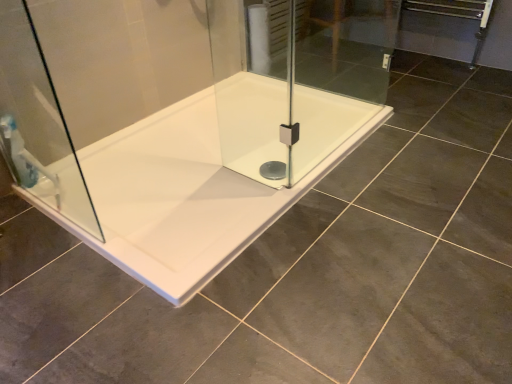
Question: From a real-world perspective, is translucent plastic shower at left on transparent glass shower door at left?

Choices:
 (A) yes
 (B) no

Answer: (B)

Question: Would you consider translucent plastic shower at left to be distant from transparent glass shower door at left?

Choices:
 (A) yes
 (B) no

Answer: (B)

Question: Is translucent plastic shower at left turned away from transparent glass shower door at left?

Choices:
 (A) no
 (B) yes

Answer: (B)

Question: From the image's perspective, does translucent plastic shower at left appear lower than transparent glass shower door at left?

Choices:
 (A) yes
 (B) no

Answer: (A)

Question: Considering the relative sizes of translucent plastic shower at left and transparent glass shower door at left in the image provided, is translucent plastic shower at left thinner than transparent glass shower door at left?

Choices:
 (A) yes
 (B) no

Answer: (B)

Question: Can you confirm if translucent plastic shower at left is positioned to the left of transparent glass shower door at left?

Choices:
 (A) yes
 (B) no

Answer: (A)

Question: Is white glossy bathtub at center outside transparent glass shower door at left?

Choices:
 (A) yes
 (B) no

Answer: (A)

Question: Can you confirm if white glossy bathtub at center is wider than transparent glass shower door at left?

Choices:
 (A) yes
 (B) no

Answer: (A)

Question: Can you confirm if white glossy bathtub at center is positioned to the right of transparent glass shower door at left?

Choices:
 (A) yes
 (B) no

Answer: (A)

Question: From a real-world perspective, is white glossy bathtub at center positioned over transparent glass shower door at left based on gravity?

Choices:
 (A) no
 (B) yes

Answer: (A)

Question: Is white glossy bathtub at center thinner than transparent glass shower door at left?

Choices:
 (A) yes
 (B) no

Answer: (B)

Question: Is white glossy bathtub at center smaller than transparent glass shower door at left?

Choices:
 (A) yes
 (B) no

Answer: (B)

Question: Is transparent glass shower door at left taller than white glossy bathtub at center?

Choices:
 (A) no
 (B) yes

Answer: (B)